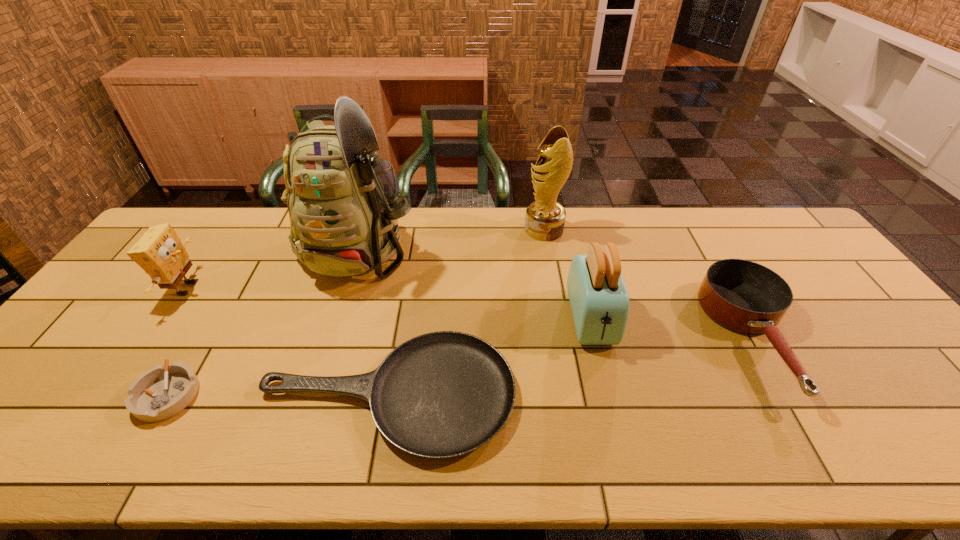
Locate an element on the screen. empty location between the second object from left to right and the tallest object is located at coordinates (264, 320).

Locate an element on the screen. This screenshot has width=960, height=540. free space that is in between the leftmost object and the backpack is located at coordinates (273, 267).

Image resolution: width=960 pixels, height=540 pixels. In order to click on vacant area that lies between the fifth tallest object and the sixth shortest object in this screenshot , I will do `click(649, 284)`.

Identify which object is the closest to the frying pan. Please provide its 2D coordinates. Your answer should be formatted as a tuple, i.e. [(x, y)], where the tuple contains the x and y coordinates of a point satisfying the conditions above.

[(161, 392)]

Select which object is the third closest to the ashtray. Please provide its 2D coordinates. Your answer should be formatted as a tuple, i.e. [(x, y)], where the tuple contains the x and y coordinates of a point satisfying the conditions above.

[(343, 204)]

Find the location of a particular element. The width and height of the screenshot is (960, 540). vacant space that satisfies the following two spatial constraints: 1. on the front-facing side of the backpack; 2. on the right side of the frying pan is located at coordinates (313, 395).

This screenshot has height=540, width=960. What are the coordinates of `vacant area in the image that satisfies the following two spatial constraints: 1. on the front-facing side of the shortest object; 2. on the left side of the backpack` in the screenshot? It's located at (313, 395).